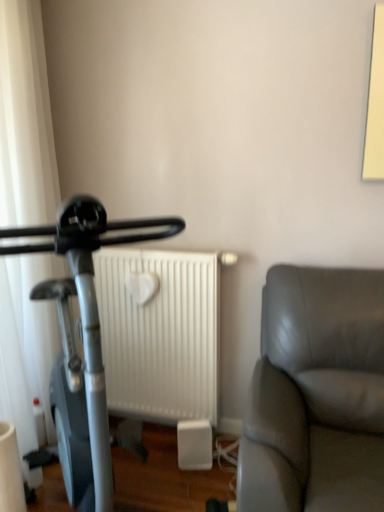
Question: Considering the positions of white sheer curtain at left and silver metallic stationary bicycle at left in the image, is white sheer curtain at left taller or shorter than silver metallic stationary bicycle at left?

Choices:
 (A) tall
 (B) short

Answer: (A)

Question: Would you say white sheer curtain at left is inside or outside silver metallic stationary bicycle at left?

Choices:
 (A) inside
 (B) outside

Answer: (B)

Question: Which is nearer to the silver metallic stationary bicycle at left?

Choices:
 (A) white matte radiator at center
 (B) white sheer curtain at left

Answer: (B)

Question: Based on their relative distances, which object is farther from the white sheer curtain at left?

Choices:
 (A) white matte radiator at center
 (B) silver metallic stationary bicycle at left

Answer: (A)